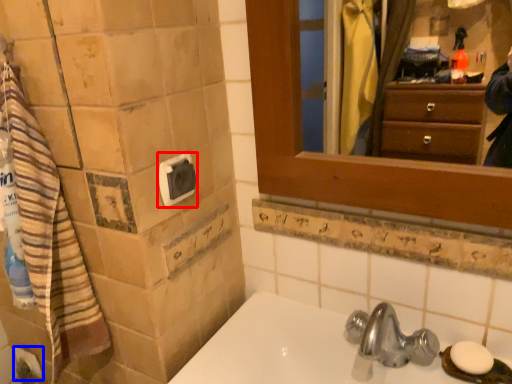
Question: Among these objects, which one is farthest to the camera, towel bar (highlighted by a red box) or toilet paper (highlighted by a blue box)?

Choices:
 (A) towel bar
 (B) toilet paper

Answer: (B)